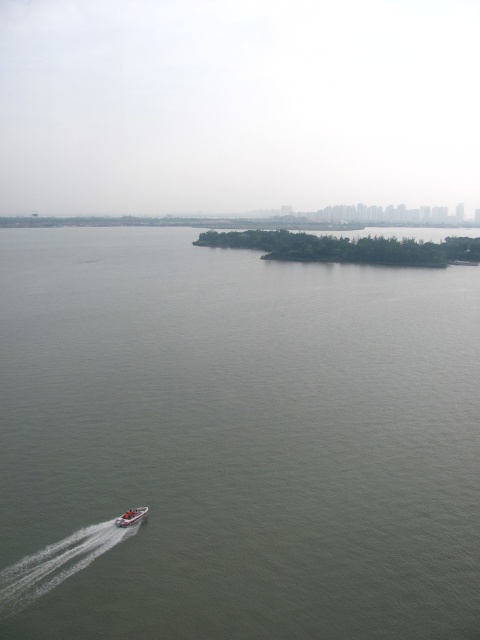
You are a photographer trying to capture the white plastic boat at lower left. You want to ensure the green water at center is visible in the background of your photo. Is this possible based on their positions?

The green water at center is in front of the white plastic boat at lower left, so the boat would block the view of the green water at center in the background. To capture the green water at center in the background, you need to position yourself so the boat is not between you and the water.

You are standing on the shore and see the green water at center and the white plastic boat at lower left. Which object is located to the right of the other?

The green water at center is positioned on the right side of white plastic boat at lower left.